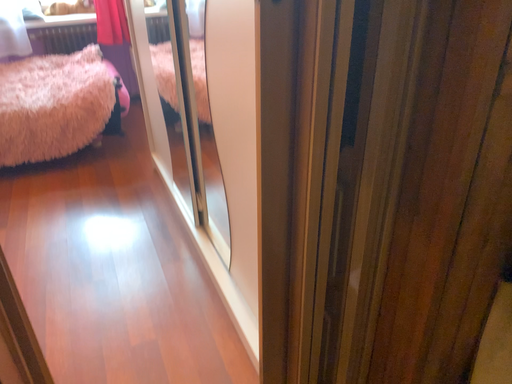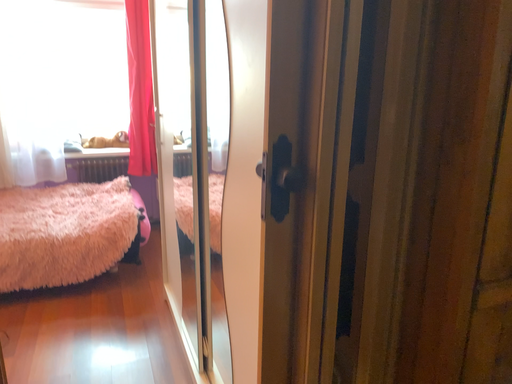
Question: How did the camera likely rotate when shooting the video?

Choices:
 (A) rotated downward
 (B) rotated upward

Answer: (B)